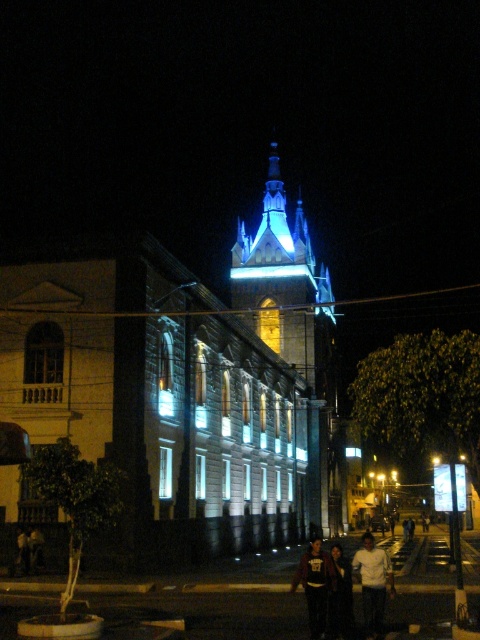
From the picture: You are an architect designing a new building and want to ensure that the blue glassy tower at upper center will not overshadow the white matte shirt at center in the final design. Based on the scene provided, is this achievable?

The blue glassy tower at upper center is bigger than the white matte shirt at center, so it will overshadow the white matte shirt at center in the final design.

You are standing at the entrance of the Gothic building and want to greet the person wearing the white matte shirt at center. In which direction should you walk to reach them?

The white matte shirt at center is located at point coordinates 0.912 on the x axis and 0.777 on the y axis. Since the coordinates are measured from the bottom left corner of the image, you should walk towards the right and slightly upwards to reach the white matte shirt at center.

You are a photographer standing in front of the Gothic building. You notice two people wearing a white matte shirt at center and a dark blue hoodie at lower center. Which of these two clothing items appears narrower in the photo?

The white matte shirt at center appears narrower because its width is less than that of the dark blue hoodie at lower center.